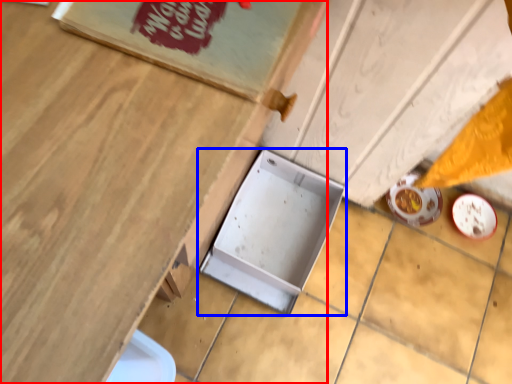
Question: Which object appears closest to the camera in this image, table (highlighted by a red box) or box (highlighted by a blue box)?

Choices:
 (A) table
 (B) box

Answer: (A)